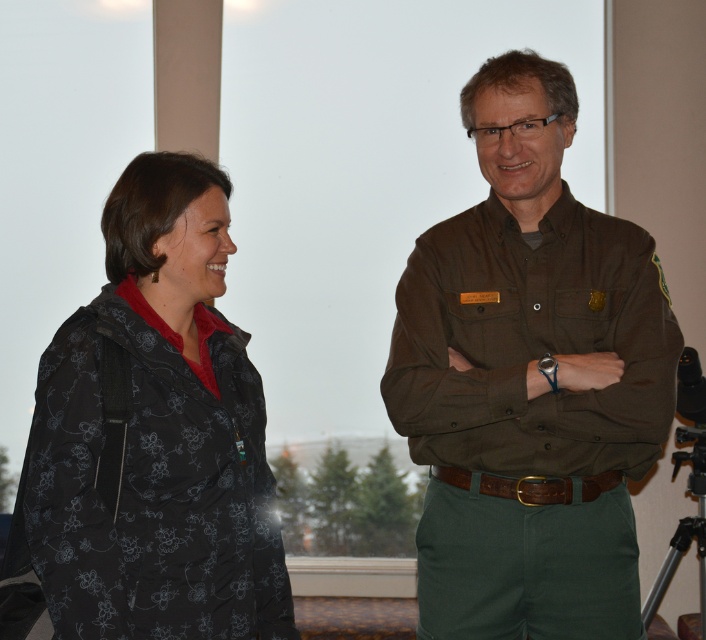
You are setting up a camera on a tripod in this conference room scene. The brown uniform at right and the black metal tripod at lower right are both visible. Which object would appear closer to the camera if they were both in the same frame?

The brown uniform at right appears closer to the camera because it is larger in size than the black metal tripod at lower right.